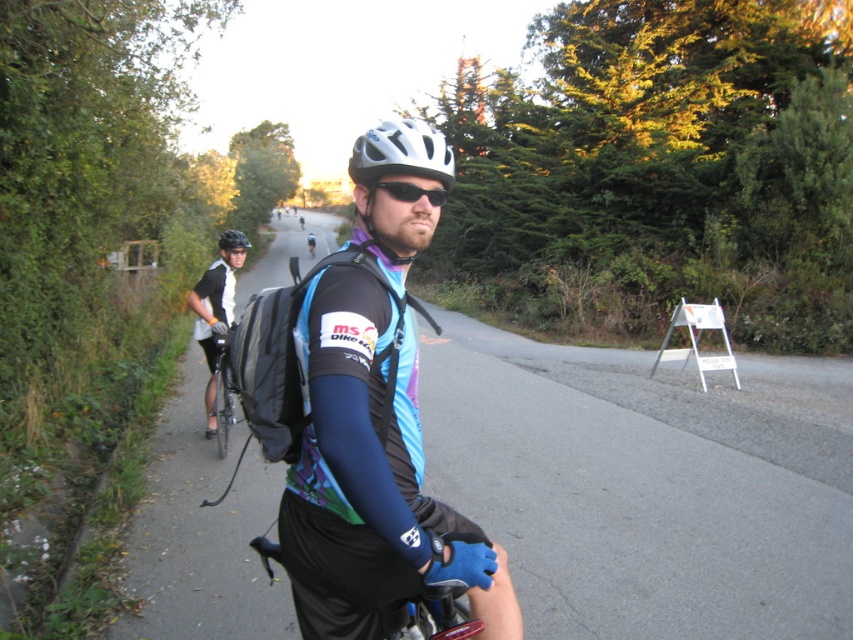
Question: Among these points, which one is farthest from the camera?

Choices:
 (A) (393, 196)
 (B) (410, 148)
 (C) (444, 600)

Answer: (A)

Question: Which point is farther from the camera taking this photo?

Choices:
 (A) (430, 589)
 (B) (415, 196)

Answer: (B)

Question: Observing the image, what is the correct spatial positioning of white matte bicycle helmet at center in reference to black matte cycling jersey at center?

Choices:
 (A) right
 (B) left

Answer: (A)

Question: Considering the relative positions of matte black cycling jersey at center and matte black helmet at upper center in the image provided, where is matte black cycling jersey at center located with respect to matte black helmet at upper center?

Choices:
 (A) right
 (B) left

Answer: (A)

Question: Is matte black cycling jersey at center bigger than white matte bicycle helmet at center?

Choices:
 (A) no
 (B) yes

Answer: (A)

Question: Which of the following is the closest to the observer?

Choices:
 (A) matte black cycling jersey at center
 (B) matte black helmet at upper center
 (C) shiny black bicycle at center

Answer: (A)